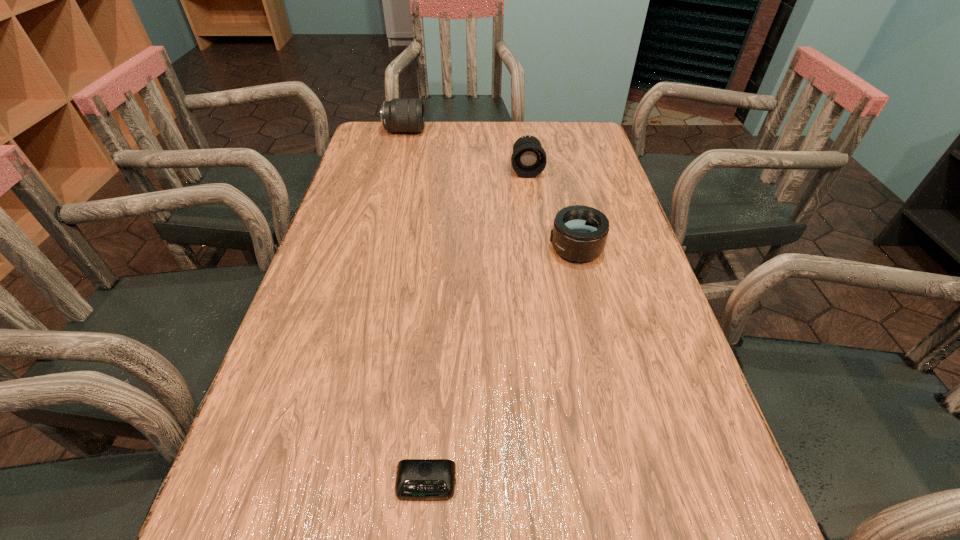
Locate which object is the closest to the second farthest telephoto lens. Please provide its 2D coordinates. Your answer should be formatted as a tuple, i.e. [(x, y)], where the tuple contains the x and y coordinates of a point satisfying the conditions above.

[(579, 233)]

Select which object is the second closest to the farthest object. Please provide its 2D coordinates. Your answer should be formatted as a tuple, i.e. [(x, y)], where the tuple contains the x and y coordinates of a point satisfying the conditions above.

[(579, 233)]

In order to click on the closest telephoto lens to the nearest telephoto lens in this screenshot , I will do `click(529, 159)`.

Identify which telephoto lens is the second nearest to the leftmost object. Please provide its 2D coordinates. Your answer should be formatted as a tuple, i.e. [(x, y)], where the tuple contains the x and y coordinates of a point satisfying the conditions above.

[(579, 233)]

In order to click on free location that satisfies the following two spatial constraints: 1. on the side of the third farthest object with brand markings and control switches; 2. on the display of the shortest object in this screenshot , I will do `click(631, 483)`.

Locate an element on the screen. Image resolution: width=960 pixels, height=540 pixels. free space that satisfies the following two spatial constraints: 1. on the side of the third tallest object with brand markings and control switches; 2. on the display of the nearest object is located at coordinates (631, 483).

Identify the location of vacant point that satisfies the following two spatial constraints: 1. on the side of the second nearest object with brand markings and control switches; 2. on the display of the alarm clock. (631, 483).

Find the location of a particular element. Image resolution: width=960 pixels, height=540 pixels. free space that satisfies the following two spatial constraints: 1. on the side of the second shortest object with brand markings and control switches; 2. on the display of the alarm clock is located at coordinates (631, 483).